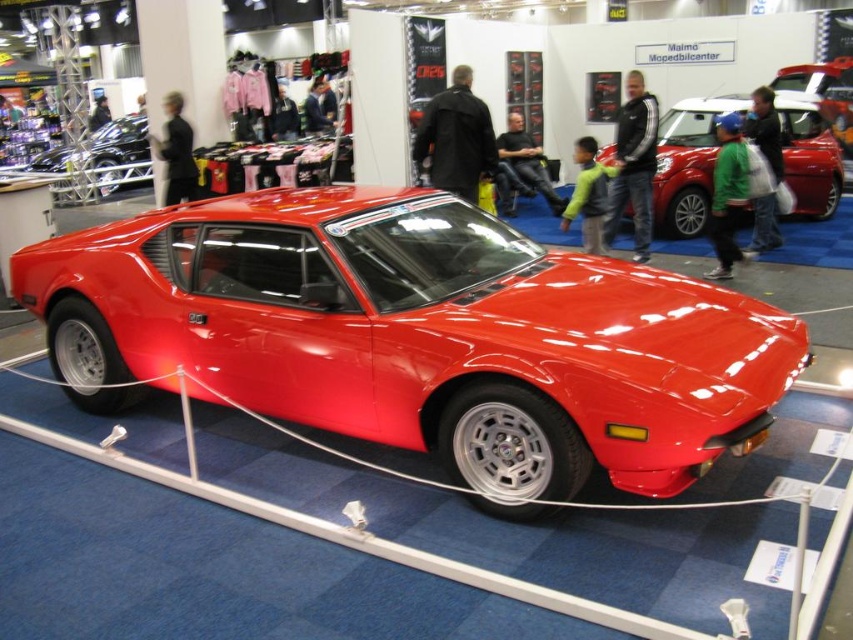
You are standing at the entrance of the car exhibition and want to locate the shiny red car at center. According to the coordinates provided, where should you look to find it?

The shiny red car at center is located at point coordinates (688, 163).

You are a photographer standing at the entrance of the car exhibition. You want to take a photo of the glossy red sports car at center without crossing the white rope barrier. The camera you are using has a maximum zoom range of 2 meters. Can you capture the entire car in your photo from your current position?

The glossy red sports car at center is 3.05 meters away from you. Since your camera can only zoom up to 2 meters, you cannot capture the entire car in your photo without moving closer or using a different camera with a longer zoom range.